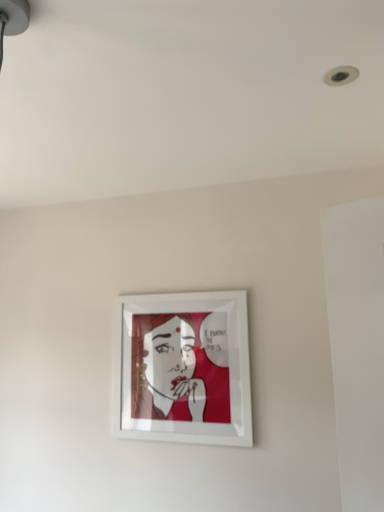
This screenshot has height=512, width=384. What do you see at coordinates (183, 368) in the screenshot?
I see `white glossy picture frame at center` at bounding box center [183, 368].

In order to click on white glossy picture frame at center in this screenshot , I will do `click(183, 368)`.

In order to face white glossy picture frame at center, should I rotate leftwards or rightwards?

To face it directly, rotate left by 2.133 degrees.

At what (x,y) coordinates should I click in order to perform the action: click on white glossy picture frame at center. Please return your answer as a coordinate pair (x, y). The width and height of the screenshot is (384, 512). Looking at the image, I should click on (183, 368).